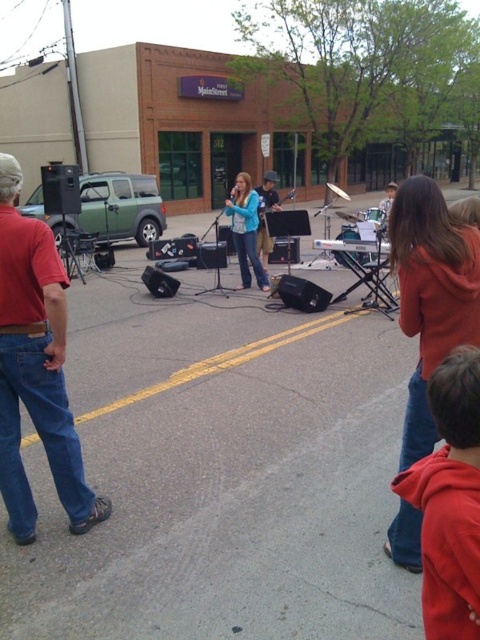
You are a photographer trying to capture a candid shot of the blue denim jeans at center and the orange hoodie at right. Since you want to ensure both are in focus, you need to know their relative sizes. Which object is smaller?

The orange hoodie at right has a smaller size compared to the blue denim jeans at center, so the orange hoodie at right is smaller.

You are a photographer trying to capture a photo of the blue denim jeans at center and the orange hoodie at right. Based on the scene, where should you position yourself to ensure both subjects are in the frame?

To capture both the orange hoodie at right and the blue denim jeans at center in the frame, position yourself so that the blue denim jeans at center is above the orange hoodie at right, as the orange hoodie at right is located below the blue denim jeans at center.

You are standing in the street performance scene. There is a point marked at coordinates (16, 339). If you want to place a small flower pot there, will it be visible to the people watching the performance from the back of the crowd?

The point is 9.43 feet away from the viewer, so placing a small flower pot there would be visible to the people watching from the back of the crowd.